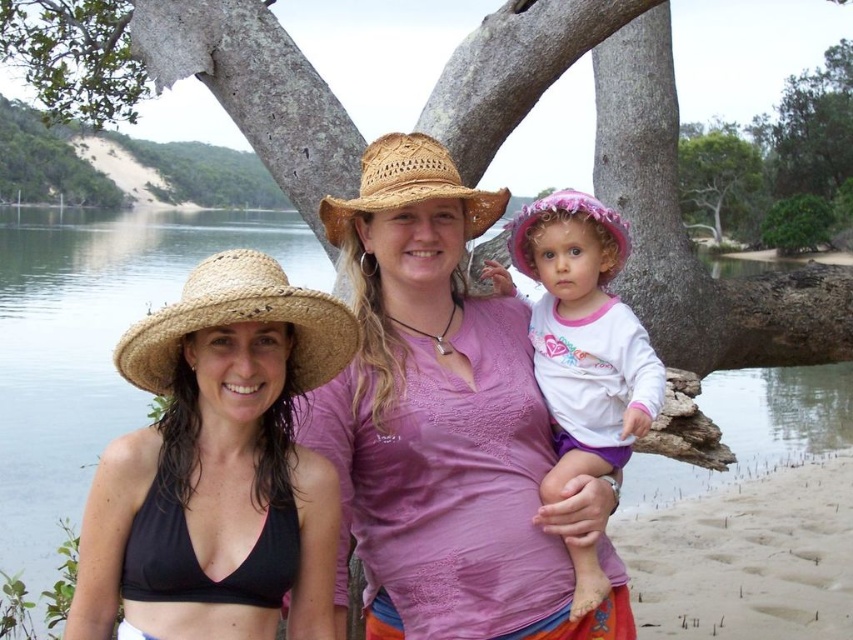
Question: Which object is the closest to the rough bark tree at center?

Choices:
 (A) pink cotton hat at center
 (B) strawhat at left
 (C) straw woven hat at center
 (D) matte straw hat at center

Answer: (D)

Question: Which point is farther from the camera taking this photo?

Choices:
 (A) (683, 172)
 (B) (607, 352)
 (C) (312, 385)
 (D) (662, 164)

Answer: (A)

Question: Does pink cotton hat at center have a greater width compared to straw woven hat at center?

Choices:
 (A) yes
 (B) no

Answer: (B)

Question: Which object is closer to the camera taking this photo?

Choices:
 (A) matte straw hat at left
 (B) green leafy tree at upper center

Answer: (A)

Question: Does matte straw hat at left have a larger size compared to green leafy tree at upper center?

Choices:
 (A) no
 (B) yes

Answer: (A)

Question: Does rough bark tree at center appear under matte straw hat at left?

Choices:
 (A) yes
 (B) no

Answer: (B)